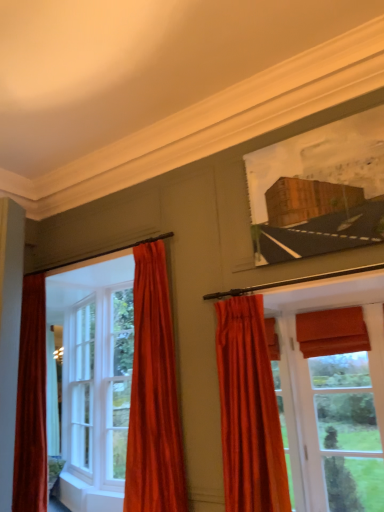
Image resolution: width=384 pixels, height=512 pixels. What do you see at coordinates (249, 410) in the screenshot?
I see `velvet orange curtain at center, the first curtain positioned from the right` at bounding box center [249, 410].

The width and height of the screenshot is (384, 512). In order to click on velvet orange curtain at center, the first curtain positioned from the right in this screenshot , I will do `click(249, 410)`.

Locate an element on the screen. window on the right of the velvet orange curtain at left, the 2th curtain when ordered from right to left is located at coordinates (344, 413).

Is velvet orange curtain at left, the 2th curtain when ordered from right to left, next to matte orange roman shade at right, the 2th window viewed from the left?

No, velvet orange curtain at left, the 2th curtain when ordered from right to left, is not in contact with matte orange roman shade at right, the 2th window viewed from the left.

Based on the photo, from the image's perspective, is velvet orange curtain at left, marked as the 1th curtain in a left-to-right arrangement, on top of matte orange roman shade at right, which appears as the 2th window when viewed from the back?

Yes.

From their relative heights in the image, would you say velvet orange curtain at left, the 2th curtain when ordered from right to left, is taller or shorter than matte orange roman shade at right, the 2th window viewed from the left?

Clearly, velvet orange curtain at left, the 2th curtain when ordered from right to left, is taller compared to matte orange roman shade at right, the 2th window viewed from the left.

Between point (371, 507) and point (154, 388), which one is positioned in front?

The point (154, 388) is closer.

In the image, is matte orange roman shade at right, placed as the 1th window when sorted from front to back, positioned in front of or behind velvet orange curtain at left, marked as the 1th curtain in a left-to-right arrangement?

matte orange roman shade at right, placed as the 1th window when sorted from front to back, is positioned farther from the viewer than velvet orange curtain at left, marked as the 1th curtain in a left-to-right arrangement.

From the picture: Is matte orange roman shade at right, which appears as the 2th window when viewed from the back, facing away from velvet orange curtain at left, marked as the 1th curtain in a left-to-right arrangement?

No, matte orange roman shade at right, which appears as the 2th window when viewed from the back, is not facing the opposite direction of velvet orange curtain at left, marked as the 1th curtain in a left-to-right arrangement.

Based on the photo, how distant is matte orange roman shade at right, which appears as the 2th window when viewed from the back, from velvet orange curtain at left, marked as the 1th curtain in a left-to-right arrangement?

matte orange roman shade at right, which appears as the 2th window when viewed from the back, and velvet orange curtain at left, marked as the 1th curtain in a left-to-right arrangement, are 1.32 meters apart from each other.

Can you confirm if white wood window at left, the first window when ordered from left to right, is shorter than velvet orange curtain at center, acting as the second curtain starting from the left?

Incorrect, the height of white wood window at left, the first window when ordered from left to right, does not fall short of that of velvet orange curtain at center, acting as the second curtain starting from the left.

Is white wood window at left, the second window viewed from the front, looking in the opposite direction of velvet orange curtain at center, acting as the second curtain starting from the left?

No, white wood window at left, the second window viewed from the front, is not facing away from velvet orange curtain at center, acting as the second curtain starting from the left.

Consider the image. Is white wood window at left, which appears as the second window when viewed from the right, smaller than velvet orange curtain at center, the first curtain positioned from the right?

Actually, white wood window at left, which appears as the second window when viewed from the right, might be larger than velvet orange curtain at center, the first curtain positioned from the right.

Is the depth of white wood window at left, the first window when ordered from left to right, greater than that of velvet orange curtain at center, acting as the second curtain starting from the left?

Yes, the depth of white wood window at left, the first window when ordered from left to right, is greater than that of velvet orange curtain at center, acting as the second curtain starting from the left.

Is matte orange roman shade at right, the 2th window viewed from the left, in front of or behind white wood window at left, which appears as the second window when viewed from the right, in the image?

matte orange roman shade at right, the 2th window viewed from the left, is in front of white wood window at left, which appears as the second window when viewed from the right.

Is matte orange roman shade at right, placed as the 1th window when sorted from front to back, facing towards white wood window at left, which appears as the second window when viewed from the right?

No.

Who is taller, matte orange roman shade at right, which appears as the 2th window when viewed from the back, or white wood window at left, acting as the first window starting from the back?

white wood window at left, acting as the first window starting from the back, is taller.

Is matte orange roman shade at right, placed as the 1th window when sorted from front to back, directly adjacent to white wood window at left, the first window when ordered from left to right?

No, matte orange roman shade at right, placed as the 1th window when sorted from front to back, is not beside white wood window at left, the first window when ordered from left to right.

From a real-world perspective, is wooden frame at upper right on top of velvet orange curtain at left, marked as the 1th curtain in a left-to-right arrangement?

Yes.

Considering the positions of objects wooden frame at upper right and velvet orange curtain at left, marked as the 1th curtain in a left-to-right arrangement, in the image provided, who is more to the right, wooden frame at upper right or velvet orange curtain at left, marked as the 1th curtain in a left-to-right arrangement,?

From the viewer's perspective, wooden frame at upper right appears more on the right side.

Which of these two, wooden frame at upper right or velvet orange curtain at left, the 2th curtain when ordered from right to left, is bigger?

velvet orange curtain at left, the 2th curtain when ordered from right to left.

Which object is closer to the camera taking this photo, wooden frame at upper right or velvet orange curtain at left, marked as the 1th curtain in a left-to-right arrangement?

wooden frame at upper right is closer to the camera.

From a real-world perspective, is velvet orange curtain at left, marked as the 1th curtain in a left-to-right arrangement, below white wood window at left, acting as the first window starting from the back?

No, from a real-world perspective, velvet orange curtain at left, marked as the 1th curtain in a left-to-right arrangement, is not beneath white wood window at left, acting as the first window starting from the back.

Is velvet orange curtain at left, marked as the 1th curtain in a left-to-right arrangement, turned away from white wood window at left, which appears as the second window when viewed from the right?

velvet orange curtain at left, marked as the 1th curtain in a left-to-right arrangement, does not have its back to white wood window at left, which appears as the second window when viewed from the right.

Considering the sizes of velvet orange curtain at left, the 2th curtain when ordered from right to left, and white wood window at left, the first window when ordered from left to right, in the image, is velvet orange curtain at left, the 2th curtain when ordered from right to left, wider or thinner than white wood window at left, the first window when ordered from left to right,?

velvet orange curtain at left, the 2th curtain when ordered from right to left, is wider than white wood window at left, the first window when ordered from left to right.

Is matte orange roman shade at right, placed as the 1th window when sorted from front to back, not near velvet orange curtain at center, the first curtain positioned from the right?

No, matte orange roman shade at right, placed as the 1th window when sorted from front to back, is in close proximity to velvet orange curtain at center, the first curtain positioned from the right.

What's the angular difference between matte orange roman shade at right, which appears as the 2th window when viewed from the back, and velvet orange curtain at center, acting as the second curtain starting from the left,'s facing directions?

There is a 0.805-degree angle between the facing directions of matte orange roman shade at right, which appears as the 2th window when viewed from the back, and velvet orange curtain at center, acting as the second curtain starting from the left.

Considering the relative sizes of matte orange roman shade at right, which appears as the 2th window when viewed from the back, and velvet orange curtain at center, acting as the second curtain starting from the left, in the image provided, is matte orange roman shade at right, which appears as the 2th window when viewed from the back, taller than velvet orange curtain at center, acting as the second curtain starting from the left,?

Yes, matte orange roman shade at right, which appears as the 2th window when viewed from the back, is taller than velvet orange curtain at center, acting as the second curtain starting from the left.

Can you confirm if matte orange roman shade at right, the 2th window viewed from the left, is wider than velvet orange curtain at center, the first curtain positioned from the right?

No.

You are a GUI agent. You are given a task and a screenshot of the screen. Output one action in this format:
    pyautogui.click(x=<x>, y=<y>)
    Task: Click on the 1st window below when counting from the velvet orange curtain at left, marked as the 1th curtain in a left-to-right arrangement (from the image's perspective)
    The width and height of the screenshot is (384, 512).
    Given the screenshot: What is the action you would take?
    pyautogui.click(x=344, y=413)

Find the location of a particular element. window on the right of velvet orange curtain at left, marked as the 1th curtain in a left-to-right arrangement is located at coordinates (344, 413).

In the scene shown: Which object lies nearer to the anchor point velvet orange curtain at left, the 2th curtain when ordered from right to left, velvet orange curtain at center, the first curtain positioned from the right, or matte orange roman shade at right, which appears as the 2th window when viewed from the back?

velvet orange curtain at center, the first curtain positioned from the right, is positioned closer to the anchor velvet orange curtain at left, the 2th curtain when ordered from right to left.

When comparing their distances from velvet orange curtain at left, the 2th curtain when ordered from right to left, does velvet orange curtain at center, acting as the second curtain starting from the left, or white wood window at left, which appears as the second window when viewed from the right, seem further?

The object further to velvet orange curtain at left, the 2th curtain when ordered from right to left, is white wood window at left, which appears as the second window when viewed from the right.

From the image, which object appears to be farther from matte orange roman shade at right, which ranks as the first window in right-to-left order, velvet orange curtain at left, marked as the 1th curtain in a left-to-right arrangement, or white wood window at left, which appears as the second window when viewed from the right?

The object further to matte orange roman shade at right, which ranks as the first window in right-to-left order, is white wood window at left, which appears as the second window when viewed from the right.

Estimate the real-world distances between objects in this image. Which object is closer to white wood window at left, acting as the first window starting from the back, matte orange roman shade at right, placed as the 1th window when sorted from front to back, or velvet orange curtain at left, marked as the 1th curtain in a left-to-right arrangement?

velvet orange curtain at left, marked as the 1th curtain in a left-to-right arrangement.

From the image, which object appears to be nearer to white wood window at left, the second window viewed from the front, velvet orange curtain at left, marked as the 1th curtain in a left-to-right arrangement, or wooden frame at upper right?

velvet orange curtain at left, marked as the 1th curtain in a left-to-right arrangement, is closer to white wood window at left, the second window viewed from the front.

When comparing their distances from white wood window at left, the first window when ordered from left to right, does velvet orange curtain at center, the first curtain positioned from the right, or wooden frame at upper right seem closer?

Among the two, velvet orange curtain at center, the first curtain positioned from the right, is located nearer to white wood window at left, the first window when ordered from left to right.

From the image, which object appears to be farther from wooden frame at upper right, velvet orange curtain at center, the first curtain positioned from the right, or matte orange roman shade at right, which appears as the 2th window when viewed from the back?

The object further to wooden frame at upper right is matte orange roman shade at right, which appears as the 2th window when viewed from the back.

When comparing their distances from velvet orange curtain at left, marked as the 1th curtain in a left-to-right arrangement, does matte orange roman shade at right, the 2th window viewed from the left, or wooden frame at upper right seem closer?

wooden frame at upper right is positioned closer to the anchor velvet orange curtain at left, marked as the 1th curtain in a left-to-right arrangement.

Where is `picture frame located between white wood window at left, the second window viewed from the front, and matte orange roman shade at right, which appears as the 2th window when viewed from the back, in the left-right direction`? Image resolution: width=384 pixels, height=512 pixels. picture frame located between white wood window at left, the second window viewed from the front, and matte orange roman shade at right, which appears as the 2th window when viewed from the back, in the left-right direction is located at coordinates (319, 190).

I want to click on curtain that lies between wooden frame at upper right and velvet orange curtain at center, acting as the second curtain starting from the left, from top to bottom, so click(153, 394).

In order to click on curtain positioned between wooden frame at upper right and white wood window at left, which appears as the second window when viewed from the right, from near to far in this screenshot , I will do `click(153, 394)`.

You are a GUI agent. You are given a task and a screenshot of the screen. Output one action in this format:
    pyautogui.click(x=<x>, y=<y>)
    Task: Click on the picture frame located between velvet orange curtain at center, the first curtain positioned from the right, and white wood window at left, which appears as the second window when viewed from the right, in the depth direction
    
    Given the screenshot: What is the action you would take?
    pyautogui.click(x=319, y=190)